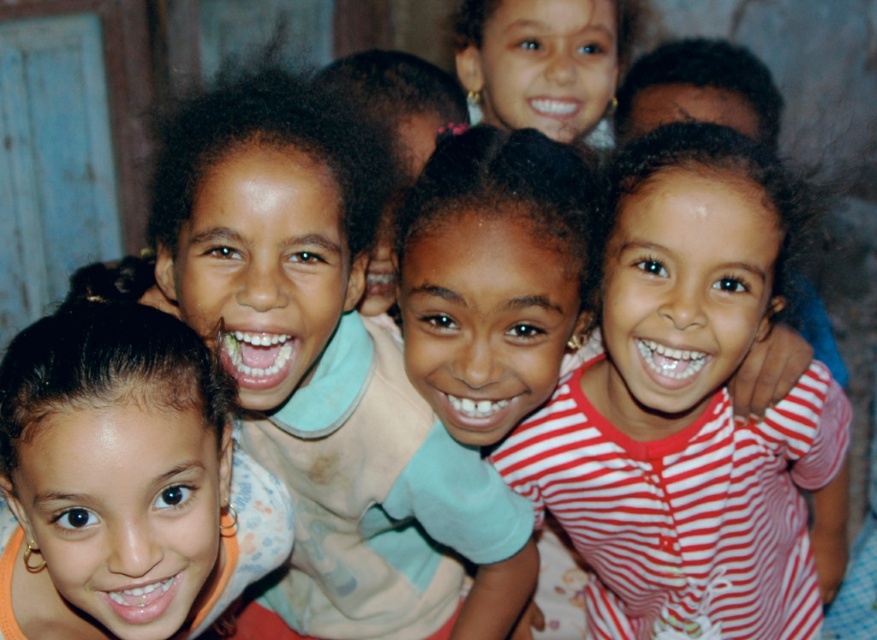
Question: Among these points, which one is farthest from the camera?

Choices:
 (A) (505, 29)
 (B) (646, 353)
 (C) (98, 522)

Answer: (A)

Question: Which object appears farthest from the camera in this image?

Choices:
 (A) matte orange shirt at lower left
 (B) matte black hair at upper center
 (C) red striped shirt at center

Answer: (B)

Question: Does red striped shirt at center lie behind matte black hair at upper center?

Choices:
 (A) yes
 (B) no

Answer: (B)

Question: Based on their relative distances, which object is farther from the red striped shirt at center?

Choices:
 (A) matte orange shirt at lower left
 (B) matte black hair at upper center

Answer: (B)

Question: Considering the relative positions of red striped shirt at center and matte orange shirt at lower left in the image provided, where is red striped shirt at center located with respect to matte orange shirt at lower left?

Choices:
 (A) left
 (B) right

Answer: (B)

Question: Is red striped shirt at center closer to camera compared to matte black hair at upper center?

Choices:
 (A) yes
 (B) no

Answer: (A)